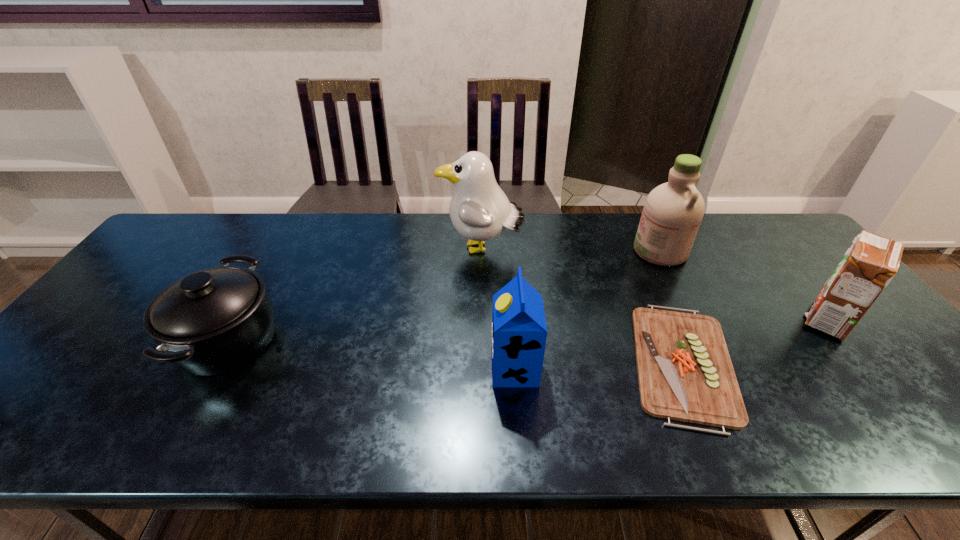
This screenshot has height=540, width=960. I want to click on vacant space located on the left of the saucepan, so click(x=153, y=339).

Where is `vacant area situated 0.240m on the left of the shortest object`? This screenshot has width=960, height=540. vacant area situated 0.240m on the left of the shortest object is located at coordinates (527, 363).

This screenshot has width=960, height=540. Identify the location of gull that is at the far edge. (479, 210).

Locate an element on the screen. This screenshot has height=540, width=960. cleansing agent located in the far edge section of the desktop is located at coordinates (673, 211).

Where is `object located at the near edge`? The image size is (960, 540). object located at the near edge is located at coordinates (685, 373).

The image size is (960, 540). I want to click on object that is at the right edge, so click(867, 267).

Where is `free space at the far edge of the desktop`? The width and height of the screenshot is (960, 540). free space at the far edge of the desktop is located at coordinates (557, 244).

This screenshot has width=960, height=540. I want to click on vacant space at the near edge, so click(x=838, y=429).

The height and width of the screenshot is (540, 960). Find the location of `vacant space at the left edge of the desktop`. vacant space at the left edge of the desktop is located at coordinates (105, 345).

Locate an element on the screen. vacant space at the far left corner of the desktop is located at coordinates (170, 232).